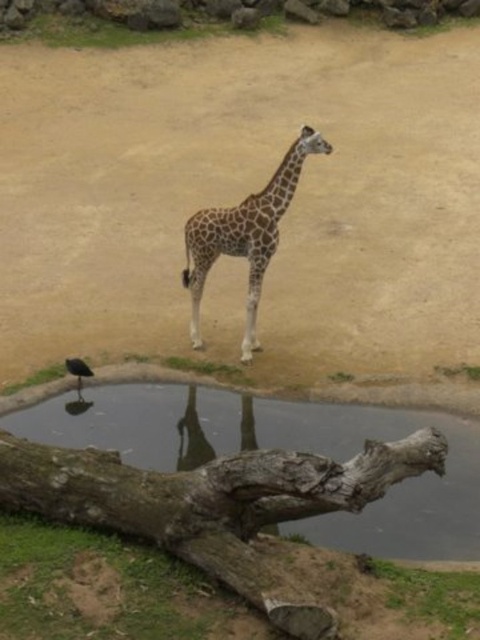
Can you confirm if brown sandy dirt at center is wider than spotted fur giraffe at center?

Yes, brown sandy dirt at center is wider than spotted fur giraffe at center.

Which is more to the right, brown sandy dirt at center or spotted fur giraffe at center?

From the viewer's perspective, spotted fur giraffe at center appears more on the right side.

What do you see at coordinates (241, 196) in the screenshot? I see `brown sandy dirt at center` at bounding box center [241, 196].

Where is `brown sandy dirt at center`? The height and width of the screenshot is (640, 480). brown sandy dirt at center is located at coordinates (241, 196).

Can you confirm if spotted fur giraffe at center is smaller than shiny black bird at lower left?

No.

Does point (253, 316) come in front of point (76, 362)?

No.

Is point (238, 232) positioned after point (80, 371)?

Yes, point (238, 232) is farther from viewer.

Find the location of a particular element. The image size is (480, 640). spotted fur giraffe at center is located at coordinates (244, 234).

Does brown sandy dirt at center have a greater height compared to shiny black bird at lower left?

Correct, brown sandy dirt at center is much taller as shiny black bird at lower left.

Does point (193, 54) lie in front of point (69, 369)?

No, it is not.

Is point (223, 298) closer to viewer compared to point (78, 387)?

No, it is not.

The image size is (480, 640). In order to click on brown sandy dirt at center in this screenshot , I will do `click(241, 196)`.